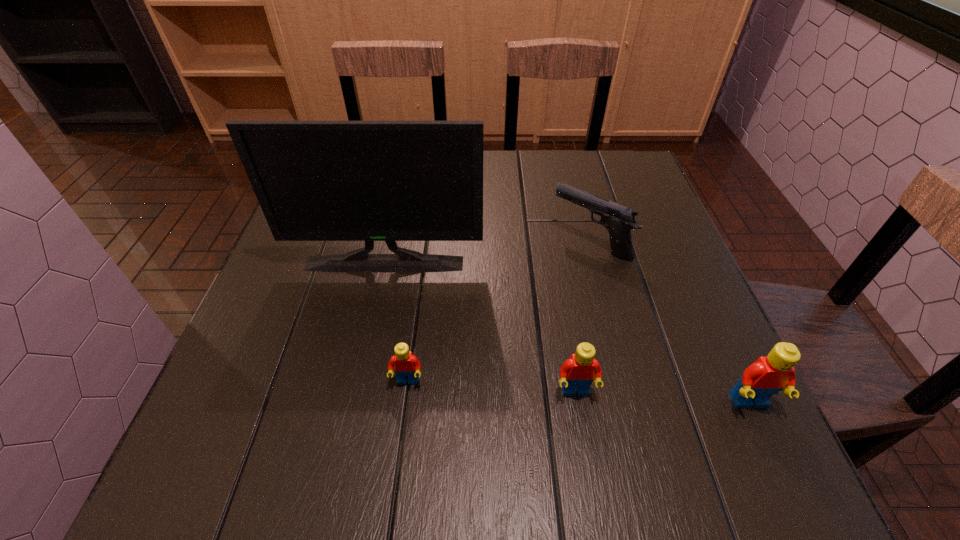
Considering the uniform spacing of Legos, where should an additional Lego be positioned on the left? Please locate a free spot. Please provide its 2D coordinates. Your answer should be formatted as a tuple, i.e. [(x, y)], where the tuple contains the x and y coordinates of a point satisfying the conditions above.

[(246, 372)]